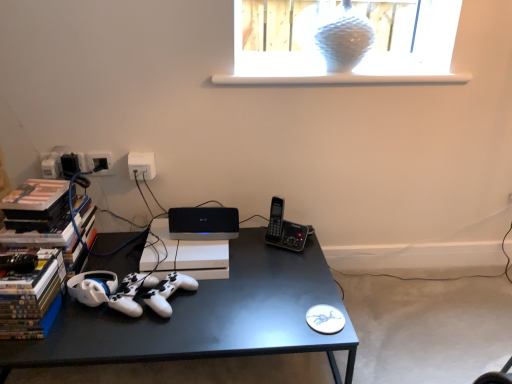
The height and width of the screenshot is (384, 512). I want to click on vacant area located to the right-hand side of transparent textured glass vase at upper center, so click(x=387, y=67).